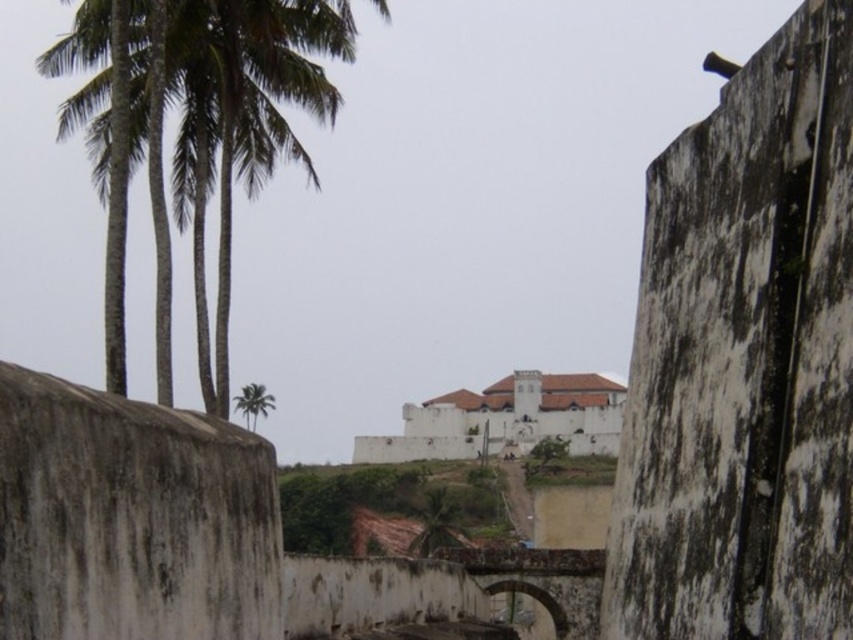
Question: Which point is closer to the camera taking this photo?

Choices:
 (A) (483, 433)
 (B) (264, 387)
 (C) (74, 125)

Answer: (C)

Question: Can you confirm if white matte building at center is thinner than green leafy palm tree at upper left?

Choices:
 (A) no
 (B) yes

Answer: (A)

Question: Considering the relative positions of white matte building at center and green leafy palm tree at upper left in the image provided, where is white matte building at center located with respect to green leafy palm tree at upper left?

Choices:
 (A) below
 (B) above

Answer: (B)

Question: Which point appears farthest from the camera in this image?

Choices:
 (A) (556, 372)
 (B) (265, 417)
 (C) (230, 202)

Answer: (A)

Question: Is green leafy palm trees at left in front of green leafy palm tree at upper left?

Choices:
 (A) yes
 (B) no

Answer: (A)

Question: Which object appears farthest from the camera in this image?

Choices:
 (A) white matte building at center
 (B) green leafy palm trees at left

Answer: (A)